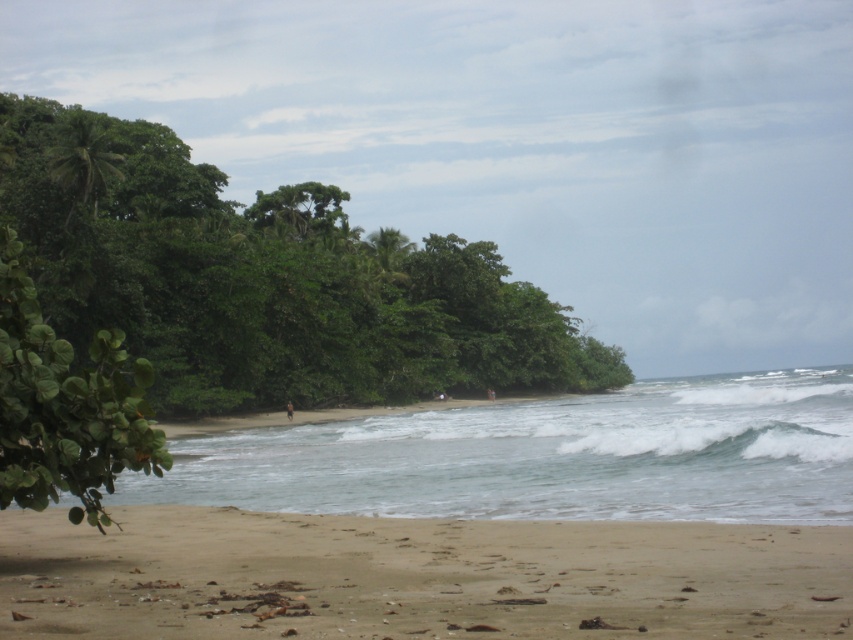
Question: Can you confirm if clear blue water at center is thinner than green leafy tree at left?

Choices:
 (A) no
 (B) yes

Answer: (A)

Question: Is green leafy trees at left bigger than clear blue water at center?

Choices:
 (A) yes
 (B) no

Answer: (A)

Question: Is green leafy trees at left wider than sandy beach at lower center?

Choices:
 (A) yes
 (B) no

Answer: (A)

Question: Which object appears closest to the camera in this image?

Choices:
 (A) green leafy trees at left
 (B) sandy beach at lower center
 (C) green leafy tree at left

Answer: (B)

Question: Which object is farther from the camera taking this photo?

Choices:
 (A) sandy beach at lower center
 (B) green leafy trees at left

Answer: (B)

Question: Which point is farther to the camera?

Choices:
 (A) sandy beach at lower center
 (B) clear blue water at center
 (C) green leafy trees at left

Answer: (C)